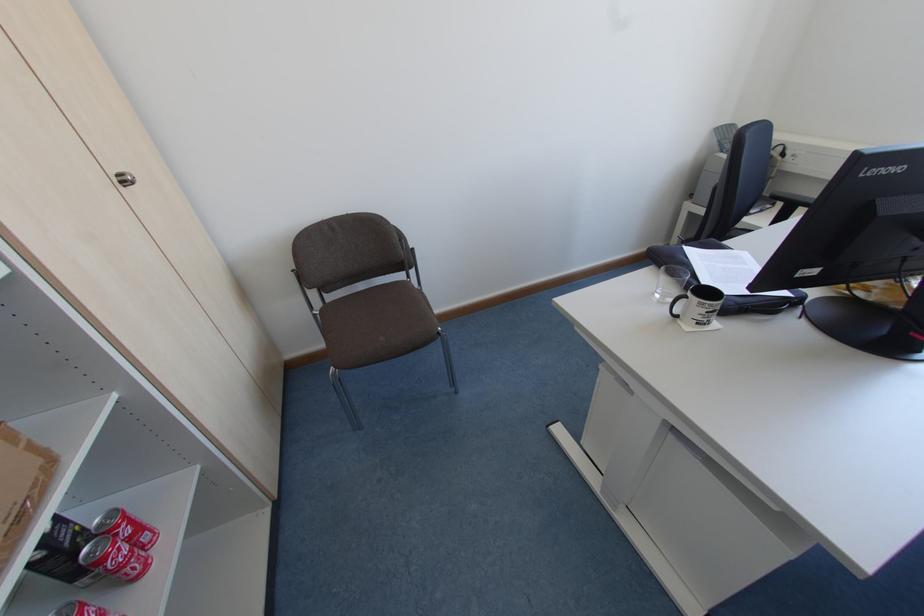
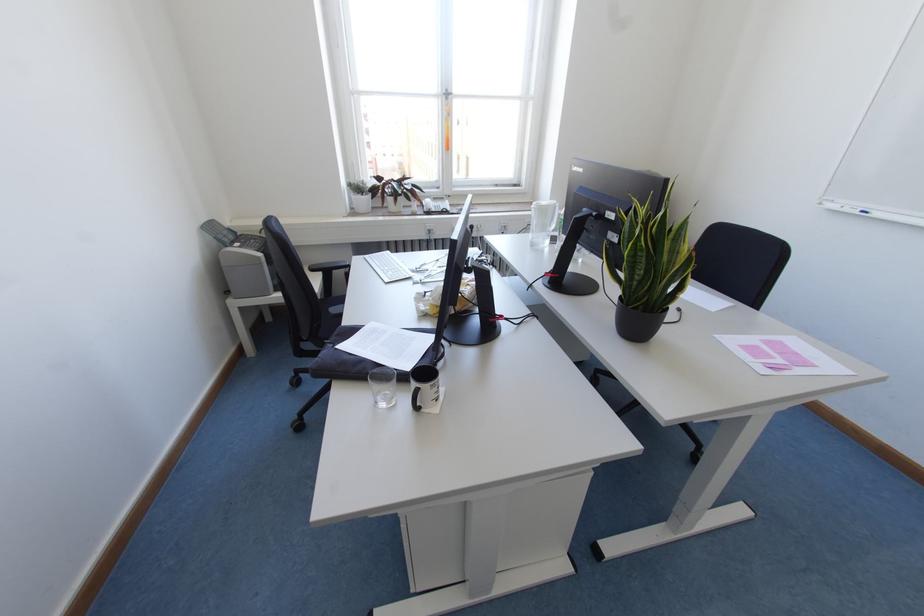
The point at (687, 297) is marked in the first image. Where is the corresponding point in the second image?

(419, 387)